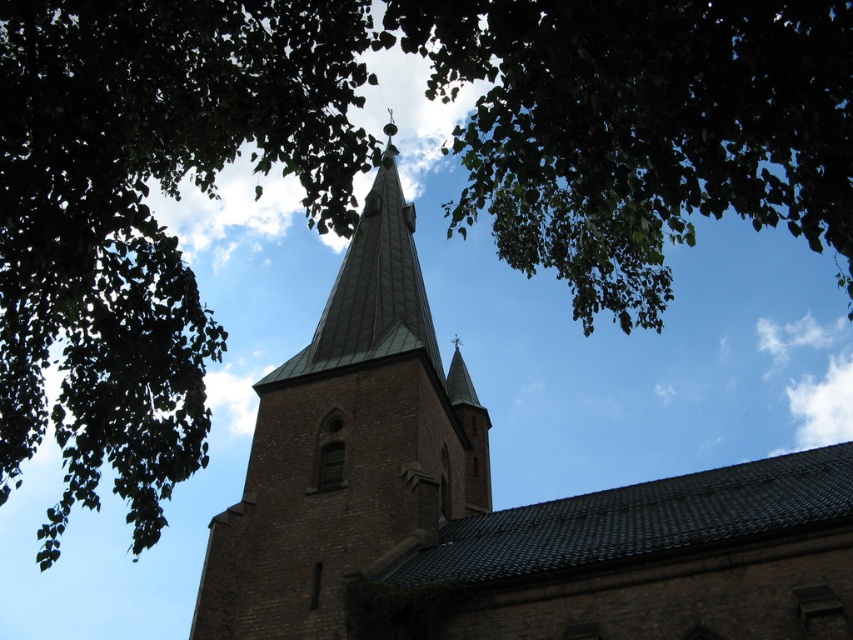
Question: Which point is closer to the camera taking this photo?

Choices:
 (A) (671, 195)
 (B) (161, 493)
 (C) (312, 387)
 (D) (436, 570)

Answer: (A)

Question: Does green leafy tree at upper left appear on the right side of green leafy branches at upper center?

Choices:
 (A) yes
 (B) no

Answer: (B)

Question: Which object appears farthest from the camera in this image?

Choices:
 (A) brown brick tower at center
 (B) brown brick church steeple at center

Answer: (A)

Question: Among these objects, which one is nearest to the camera?

Choices:
 (A) brown brick church steeple at center
 (B) green leafy tree at upper left
 (C) green leafy branches at upper center

Answer: (C)

Question: Can you confirm if brown brick church steeple at center is positioned below green leafy tree at upper left?

Choices:
 (A) yes
 (B) no

Answer: (A)

Question: Observing the image, what is the correct spatial positioning of green leafy branches at upper center in reference to brown brick tower at center?

Choices:
 (A) right
 (B) left

Answer: (A)